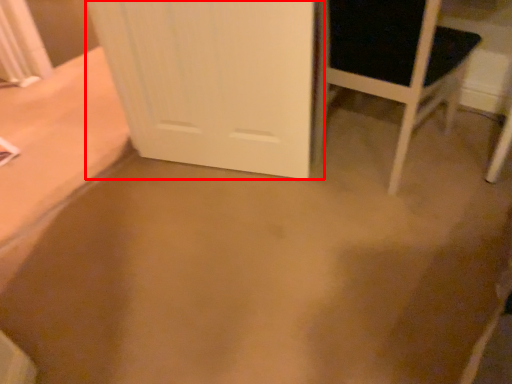
Question: From the image's perspective, what is the correct spatial positioning of door (annotated by the red box) in reference to chair?

Choices:
 (A) below
 (B) above

Answer: (A)